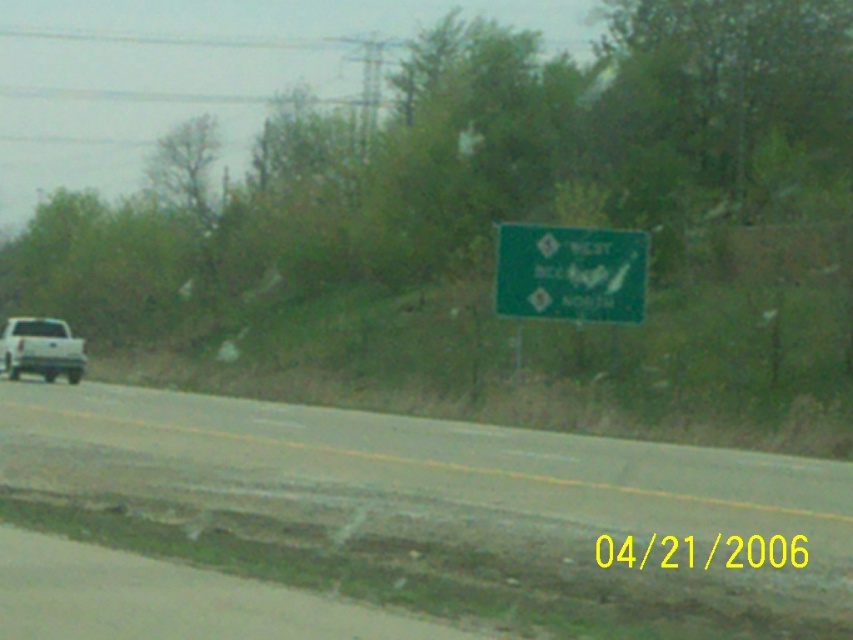
You are a driver approaching the white matte truck at left on the road. You notice a green matte sign at upper center ahead. Based on the scene, which side of the road is the green matte sign located on?

The green matte sign at upper center is located on the right side of the road relative to the white matte truck at left since it is positioned to the right of the truck.

You are a pedestrian standing at the edge of the gray asphalt road at center and want to cross to the other side. The white matte truck at left is approaching. Based on their positions, which direction should you look first before crossing?

The gray asphalt road at center is positioned on the right side of the white matte truck at left, so you should look to the left first before crossing to check the truck approaching from that direction.

You are driving a car and need to make a quick turn to avoid an obstacle. Based on the scene described, which object would you need to maneuver around first, the gray asphalt road at center or the green matte sign at upper center?

The gray asphalt road at center is wider than the green matte sign at upper center, so you would need to maneuver around the green matte sign at upper center first since it is narrower and closer to your path.